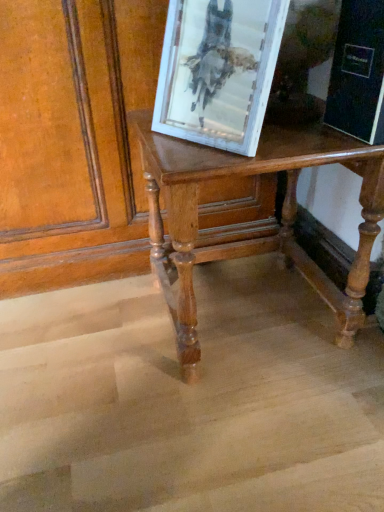
The image size is (384, 512). Find the location of `vacant space underneath shiny polished wood table at center (from a real-world perspective)`. vacant space underneath shiny polished wood table at center (from a real-world perspective) is located at coordinates (247, 315).